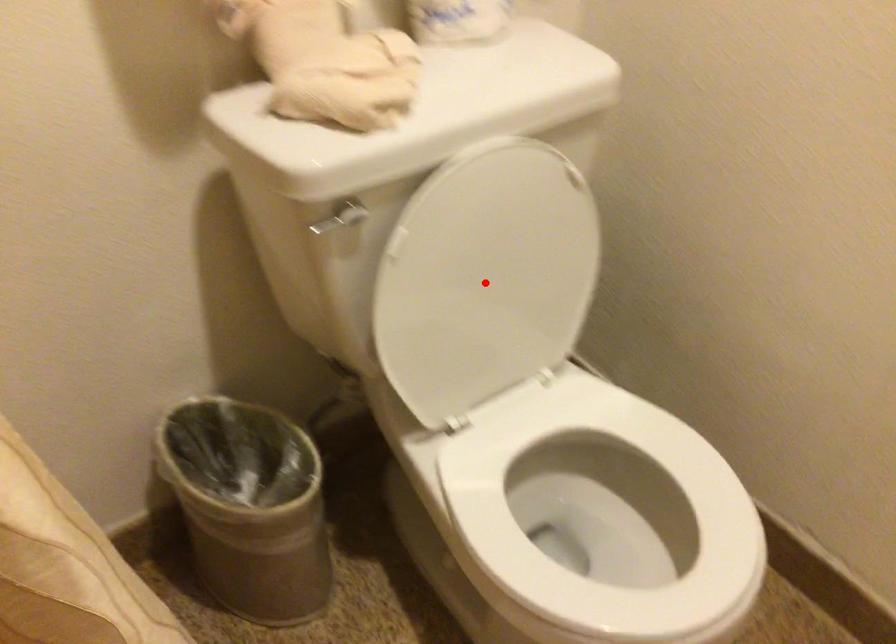
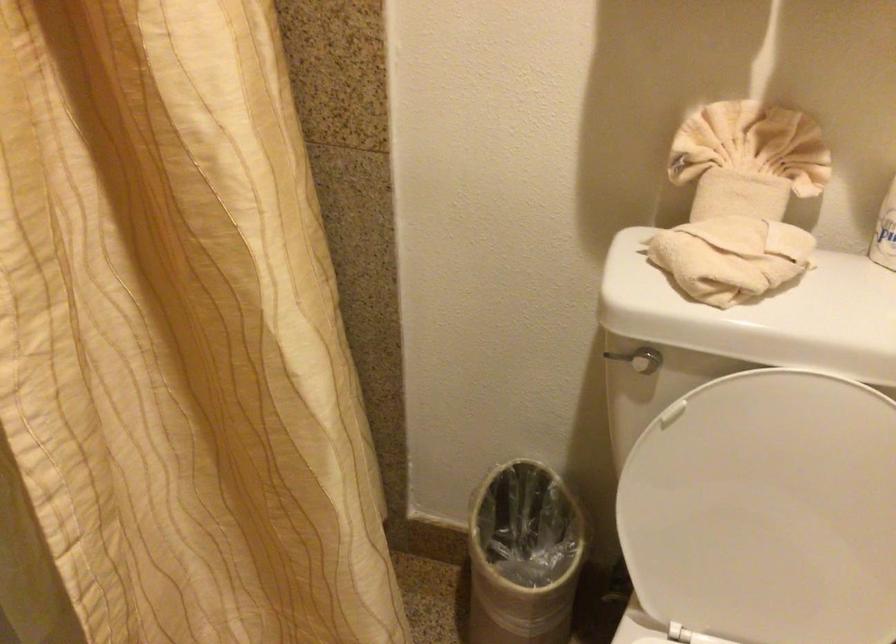
Locate, in the second image, the point that corresponds to the highlighted location in the first image.

(767, 511)